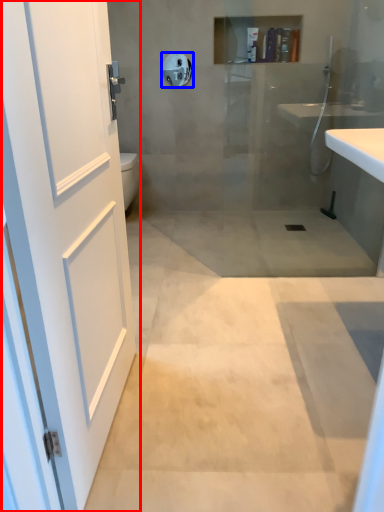
Question: Among these objects, which one is nearest to the camera, door (highlighted by a red box) or towel bar (highlighted by a blue box)?

Choices:
 (A) door
 (B) towel bar

Answer: (A)